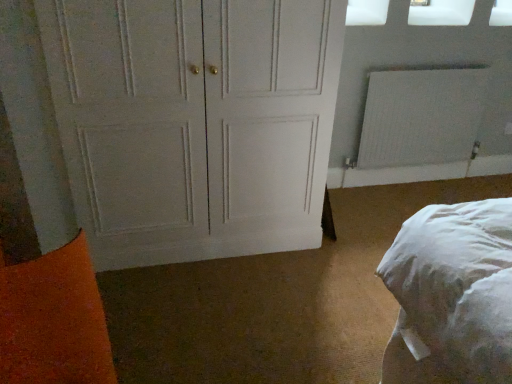
Question: Does transparent plastic window screen at upper right, the 1th window screen from the right, lie behind white painted wood door at center?

Choices:
 (A) no
 (B) yes

Answer: (B)

Question: Is transparent plastic window screen at upper right, the 1th window screen from the right, bigger than white painted wood door at center?

Choices:
 (A) yes
 (B) no

Answer: (B)

Question: From the image's perspective, is transparent plastic window screen at upper right, the 1th window screen from the right, under white painted wood door at center?

Choices:
 (A) yes
 (B) no

Answer: (B)

Question: Is transparent plastic window screen at upper right, the 1th window screen from the right, facing towards white painted wood door at center?

Choices:
 (A) no
 (B) yes

Answer: (A)

Question: Are transparent plastic window screen at upper right, positioned as the second window screen in left-to-right order, and white painted wood door at center far apart?

Choices:
 (A) no
 (B) yes

Answer: (B)

Question: Is the depth of transparent plastic window screen at upper right, positioned as the second window screen in left-to-right order, less than that of white painted wood door at center?

Choices:
 (A) no
 (B) yes

Answer: (A)

Question: Is transparent plastic window screen at upper right, positioned as the second window screen in left-to-right order, turned away from white textured radiator at upper right?

Choices:
 (A) yes
 (B) no

Answer: (B)

Question: From the image's perspective, is transparent plastic window screen at upper right, the 1th window screen from the right, beneath white textured radiator at upper right?

Choices:
 (A) yes
 (B) no

Answer: (B)

Question: Is transparent plastic window screen at upper right, the 1th window screen from the right, bigger than white textured radiator at upper right?

Choices:
 (A) no
 (B) yes

Answer: (A)

Question: From the image's perspective, is transparent plastic window screen at upper right, the 1th window screen from the right, on top of white textured radiator at upper right?

Choices:
 (A) no
 (B) yes

Answer: (B)

Question: Is the position of transparent plastic window screen at upper right, the 1th window screen from the right, less distant than that of white textured radiator at upper right?

Choices:
 (A) yes
 (B) no

Answer: (A)

Question: Is transparent plastic window screen at upper right, positioned as the second window screen in left-to-right order, beside white textured radiator at upper right?

Choices:
 (A) no
 (B) yes

Answer: (A)

Question: Is white textured radiator at upper right positioned with its back to white painted wood door at center?

Choices:
 (A) no
 (B) yes

Answer: (A)